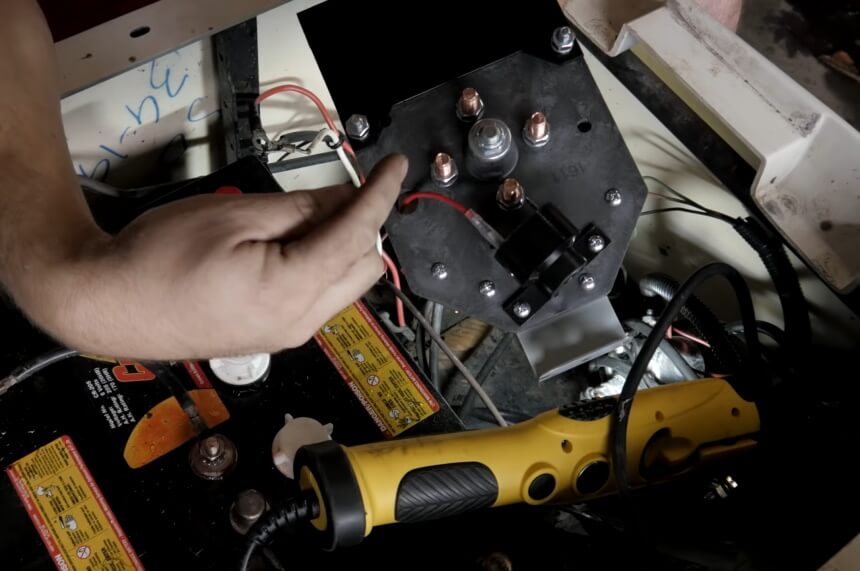
Locate an element on the screen. This screenshot has width=860, height=571. cord is located at coordinates (34, 365), (180, 388), (254, 536), (461, 365), (630, 388), (785, 280), (304, 160), (111, 188).